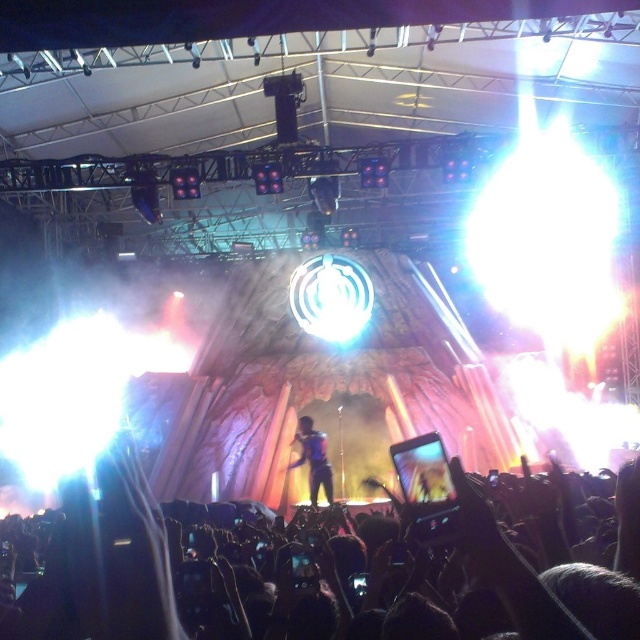
Does black matte crowd at lower center have a larger size compared to metallic blue suit at center?

Yes.

The width and height of the screenshot is (640, 640). What do you see at coordinates (304, 564) in the screenshot?
I see `black matte crowd at lower center` at bounding box center [304, 564].

Is point (38, 612) closer to viewer compared to point (307, 432)?

Yes, point (38, 612) is closer to viewer.

This screenshot has width=640, height=640. I want to click on black matte crowd at lower center, so click(304, 564).